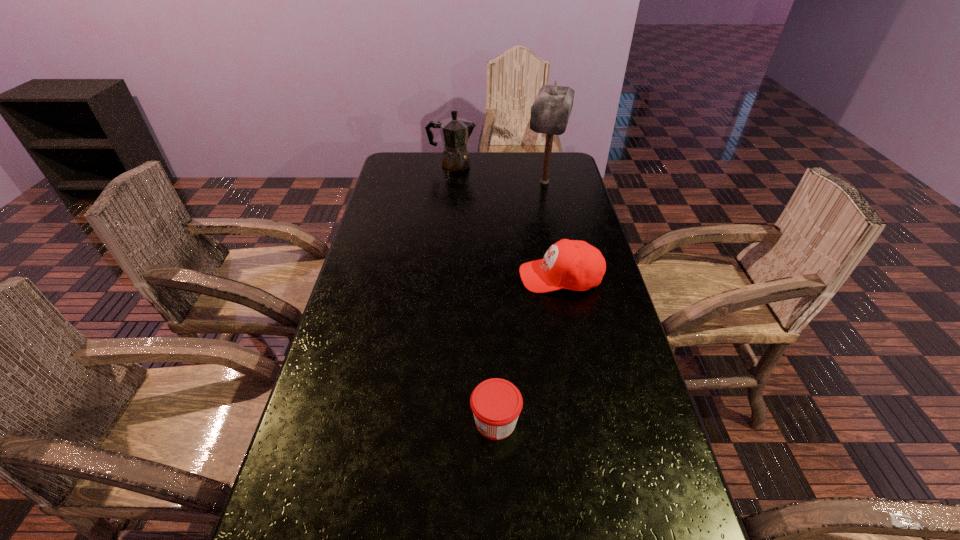
Where is `vacant region located 0.310m on the front panel of the third tallest object`? This screenshot has height=540, width=960. vacant region located 0.310m on the front panel of the third tallest object is located at coordinates (415, 277).

Find the location of a particular element. The image size is (960, 540). free space located 0.250m on the label side of the jam is located at coordinates (356, 422).

Where is `free region located 0.340m on the label side of the jam`? Image resolution: width=960 pixels, height=540 pixels. free region located 0.340m on the label side of the jam is located at coordinates tap(315, 422).

Identify the location of vacant area located 0.100m on the label side of the jam. This screenshot has width=960, height=540. (425, 422).

The height and width of the screenshot is (540, 960). I want to click on mallet positioned at the far edge, so click(550, 112).

Locate an element on the screen. coffeepot that is positioned at the far edge is located at coordinates (455, 132).

Locate an element on the screen. The height and width of the screenshot is (540, 960). mallet that is at the right edge is located at coordinates tap(550, 112).

This screenshot has width=960, height=540. What are the coordinates of `baseball cap that is positioned at the right edge` in the screenshot? It's located at (576, 265).

At what (x,y) coordinates should I click in order to perform the action: click on object that is positioned at the far right corner. Please return your answer as a coordinate pair (x, y). Looking at the image, I should click on (550, 112).

In the image, there is a desktop. Where is `blank space at the far edge`? Image resolution: width=960 pixels, height=540 pixels. blank space at the far edge is located at coordinates (495, 160).